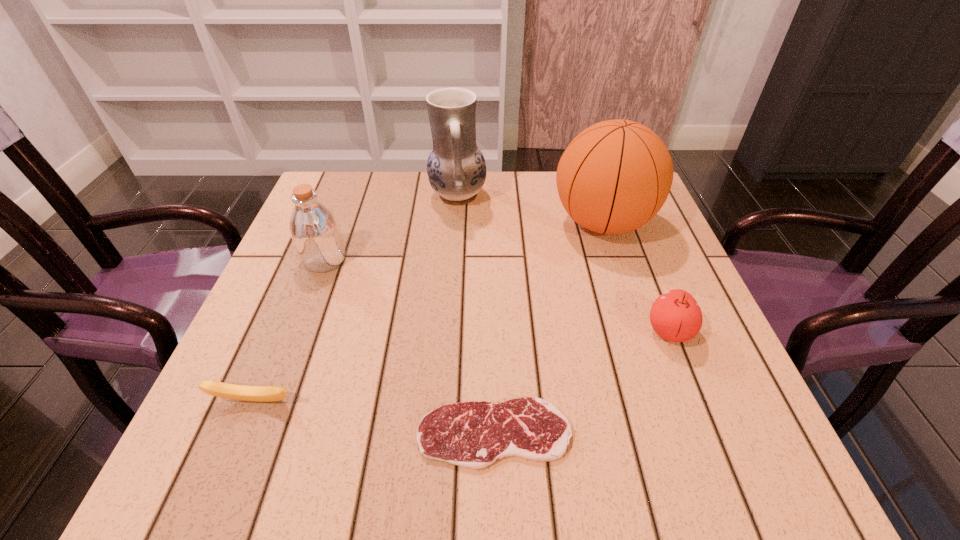
This screenshot has width=960, height=540. Find the location of `empty location between the banana and the basketball`. empty location between the banana and the basketball is located at coordinates (428, 312).

You are a GUI agent. You are given a task and a screenshot of the screen. Output one action in this format:
    pyautogui.click(x=<x>, y=<y>)
    Task: Click on the free spot between the basketball and the fourth shortest object
    
    Given the screenshot: What is the action you would take?
    pyautogui.click(x=464, y=241)

You are a GUI agent. You are given a task and a screenshot of the screen. Output one action in this format:
    pyautogui.click(x=<x>, y=<y>)
    Task: Click on the free spot between the basketball and the bottle
    
    Given the screenshot: What is the action you would take?
    pyautogui.click(x=464, y=241)

What are the coordinates of `free spot between the basketball and the steak` in the screenshot? It's located at (548, 328).

Locate an element on the screen. This screenshot has height=540, width=960. free point between the banana and the basketball is located at coordinates (428, 312).

At what (x,y) coordinates should I click in order to perform the action: click on free space between the shortest object and the apple. Please return your answer as a coordinate pair (x, y). Looking at the image, I should click on (582, 383).

Image resolution: width=960 pixels, height=540 pixels. I want to click on free space between the shortest object and the apple, so click(582, 383).

Point out which object is positioned as the fourth nearest to the fourth farthest object. Please provide its 2D coordinates. Your answer should be formatted as a tuple, i.e. [(x, y)], where the tuple contains the x and y coordinates of a point satisfying the conditions above.

[(219, 389)]

Image resolution: width=960 pixels, height=540 pixels. In order to click on the closest object to the pottery in this screenshot , I will do `click(615, 176)`.

Where is `free space that satisfies the following two spatial constraints: 1. on the back side of the pottery; 2. on the left side of the bottle`? free space that satisfies the following two spatial constraints: 1. on the back side of the pottery; 2. on the left side of the bottle is located at coordinates (348, 196).